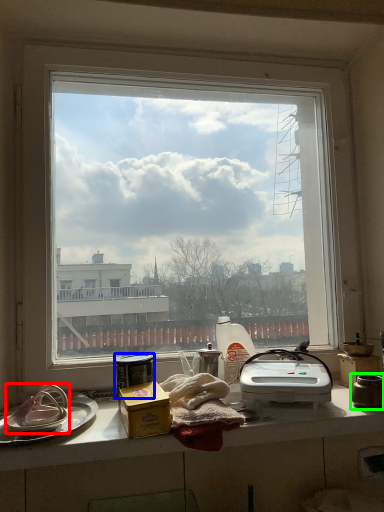
Question: Which is farther away from appliance (highlighted by a red box)? appliance (highlighted by a blue box) or appliance (highlighted by a green box)?

Choices:
 (A) appliance
 (B) appliance

Answer: (B)